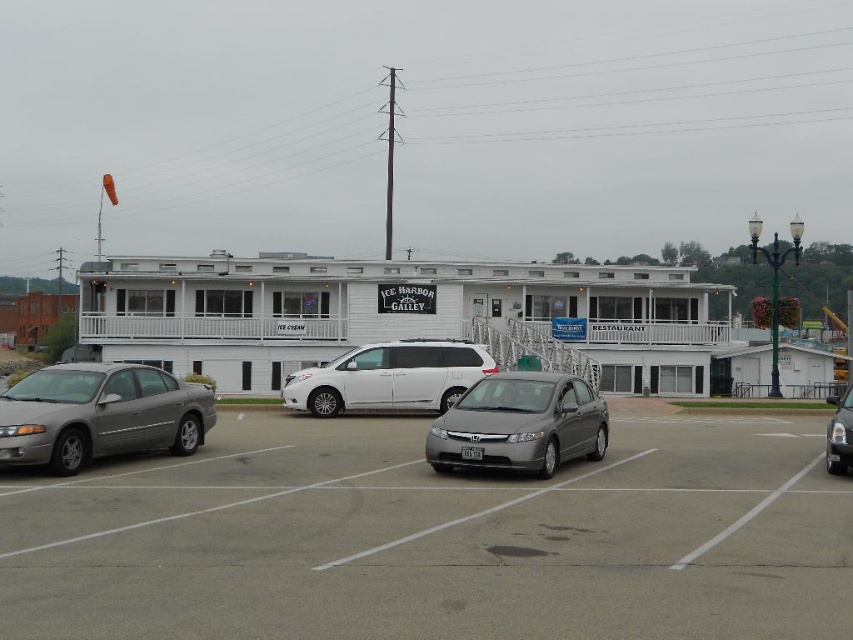
You are driving a car that is 1.8 meters wide. You want to park in the parking spot where the satin silver sedan at center is currently parked. Can your car fit into that spot if the white matte van at center is blocking the entrance? Please explain your reasoning.

The satin silver sedan at center has a lesser width compared to the white matte van at center. Since your car is 1.8 meters wide and the van is wider, the van might block the entrance, making it difficult to park your car in the satin silver sedan at center spot. However, if the van is parked behind the sedan, you might need to check the available space after moving the sedan. But based on the given information, the van being wider could obstruct access.

You are a delivery driver arriving at ICE HARBOR GALLEY. You need to park your vehicle between the silver metallic sedan at left and the white matte van at center. Is there enough space for your truck, which is 2 meters wide?

The silver metallic sedan at left is located above the white matte van at center, meaning they are parked in different rows. Therefore, there is no space between them for your truck to park.